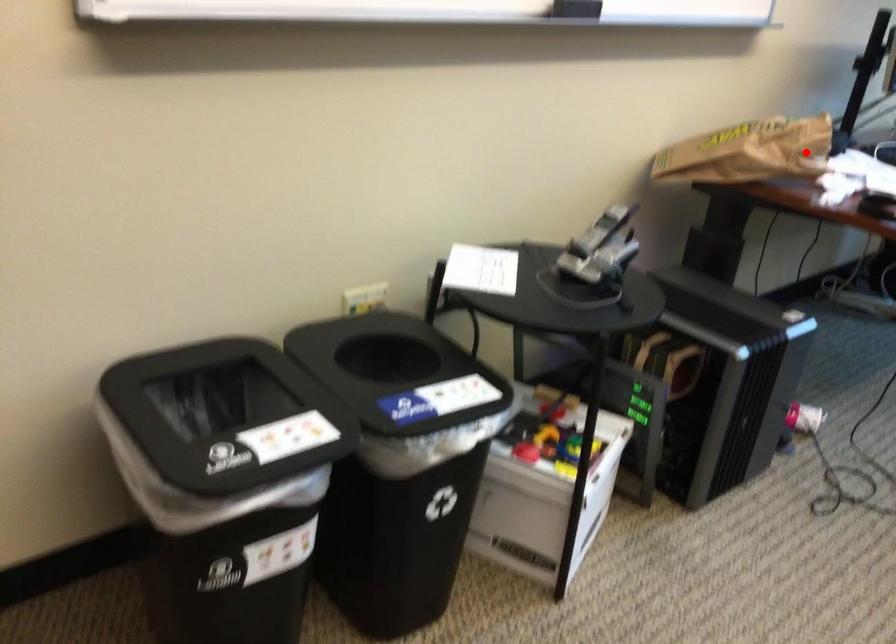
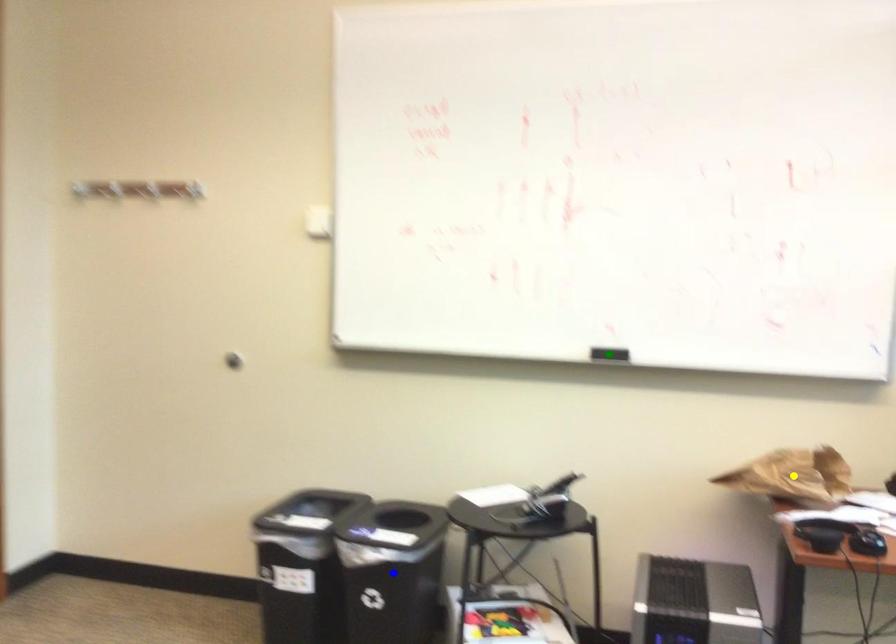
Question: I am providing you with two images of the same scene from different viewpoints. A red point is marked on the first image. You are given multiple points on the second image. Which mark in image 2 goes with the point in image 1?

Choices:
 (A) yellow point
 (B) blue point
 (C) green point

Answer: (A)